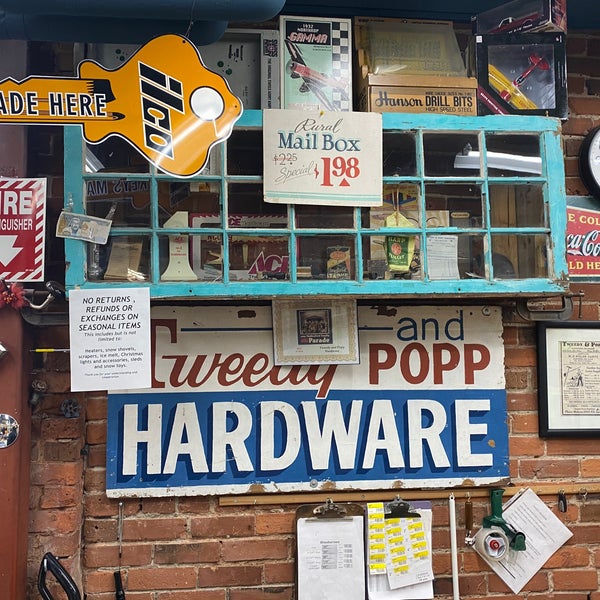
Where is `picture frame`? Image resolution: width=600 pixels, height=600 pixels. picture frame is located at coordinates (560, 66), (542, 375), (581, 324), (528, 34).